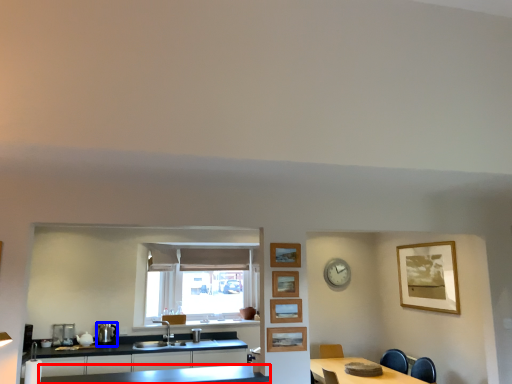
Question: Which point is further to the camera, countertop (highlighted by a red box) or appliance (highlighted by a blue box)?

Choices:
 (A) countertop
 (B) appliance

Answer: (B)